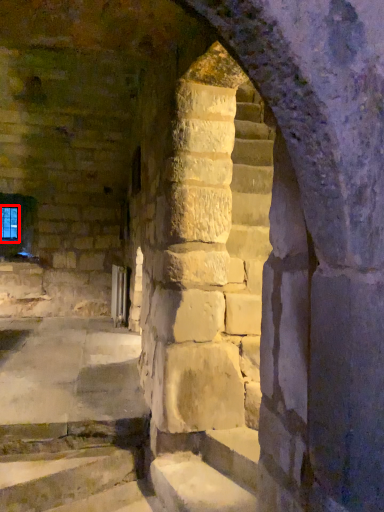
Question: From the image's perspective, where is glass window (annotated by the red box) located relative to stairwell?

Choices:
 (A) below
 (B) above

Answer: (B)